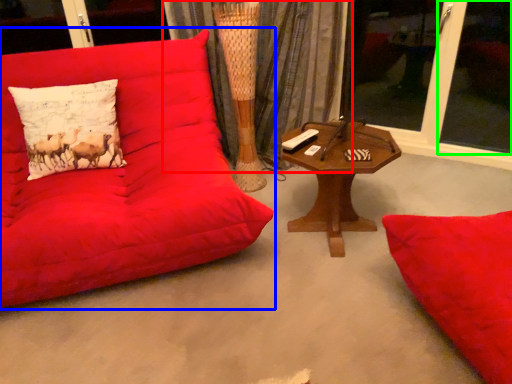
Question: Estimate the real-world distances between objects in this image. Which object is farther from curtain (highlighted by a red box), studio couch (highlighted by a blue box) or window screen (highlighted by a green box)?

Choices:
 (A) studio couch
 (B) window screen

Answer: (B)